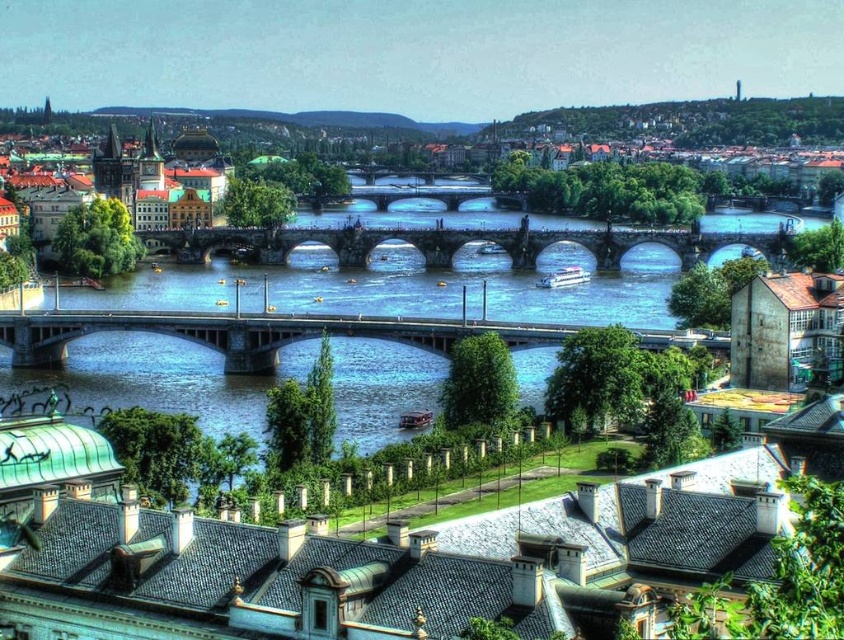
Question: Which of the following is the closest to the observer?

Choices:
 (A) tap(658, 230)
 (B) tap(291, 316)

Answer: (B)

Question: Is concrete bridge at center above stone arch bridge at center?

Choices:
 (A) no
 (B) yes

Answer: (A)

Question: Is concrete bridge at center wider than stone arch bridge at center?

Choices:
 (A) yes
 (B) no

Answer: (B)

Question: Among these points, which one is farthest from the camera?

Choices:
 (A) (523, 237)
 (B) (14, 321)

Answer: (A)

Question: Can you confirm if concrete bridge at center is bigger than stone arch bridge at center?

Choices:
 (A) no
 (B) yes

Answer: (A)